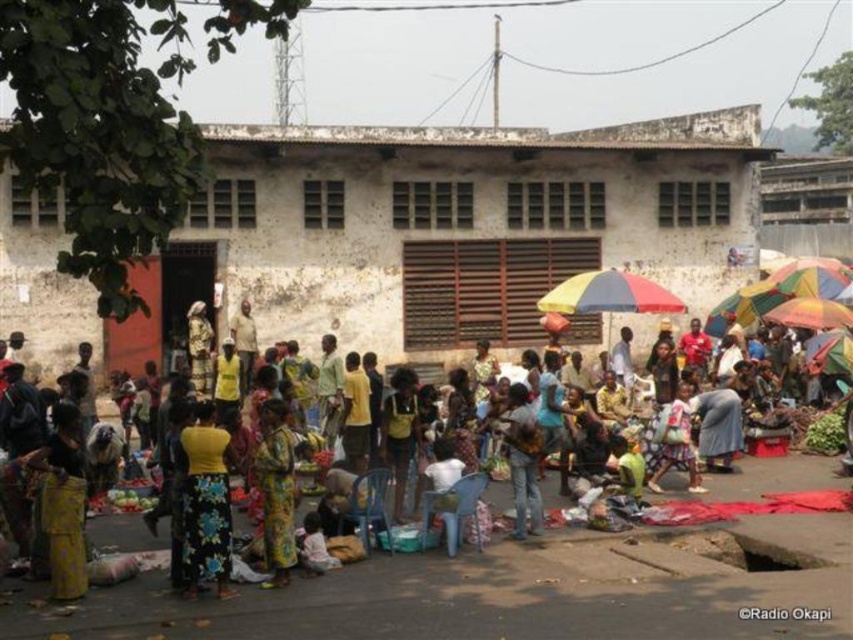
Is floral fabric market at center further to the viewer compared to rainbow fabric umbrella at center?

No, floral fabric market at center is in front of rainbow fabric umbrella at center.

Image resolution: width=853 pixels, height=640 pixels. I want to click on floral fabric market at center, so click(x=744, y=508).

Which is below, rainbow fabric umbrella at center or yellow fabric dress at center?

yellow fabric dress at center is lower down.

What do you see at coordinates (608, 294) in the screenshot?
I see `rainbow fabric umbrella at center` at bounding box center [608, 294].

The height and width of the screenshot is (640, 853). I want to click on rainbow fabric umbrella at center, so click(x=608, y=294).

Locate an element on the screen. rainbow fabric umbrella at center is located at coordinates (608, 294).

Can you confirm if floral fabric market at center is taller than yellow fabric dress at center?

No, floral fabric market at center is not taller than yellow fabric dress at center.

Between point (467, 480) and point (665, 419), which one is positioned in front?

Positioned in front is point (467, 480).

Identify the location of floral fabric market at center. Image resolution: width=853 pixels, height=640 pixels. (744, 508).